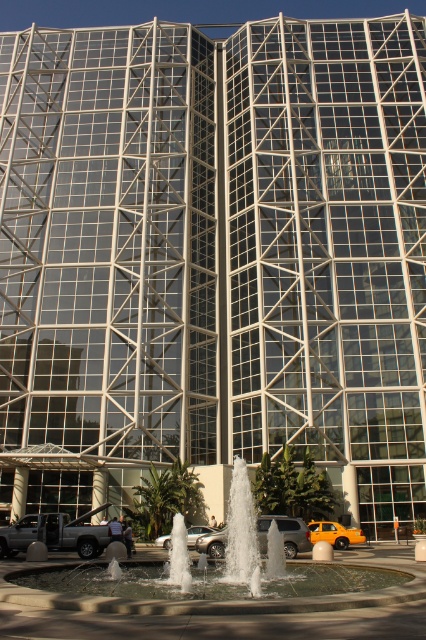
You are standing in front of the modern building with the circular fountain. You notice two points marked on the ground at coordinates point (x=74, y=545) and point (x=342, y=540). Which point is closer to your current position?

Point (x=74, y=545) is closer to the camera than point (x=342, y=540), so the point closer to your current position is point (x=74, y=545).

Consider the image. You are a pedestrian standing at the entrance of the building and want to cross the paved area to reach the fountain. There are two vehicles in your path, the silver metallic truck at lower left and the yellow matte taxi at lower center. Since you need to duck to avoid hitting your head, which vehicle should you walk around to ensure there is enough clearance?

The silver metallic truck at lower left is taller than the yellow matte taxi at lower center, so you should walk around the yellow matte taxi at lower center to ensure there is enough clearance.